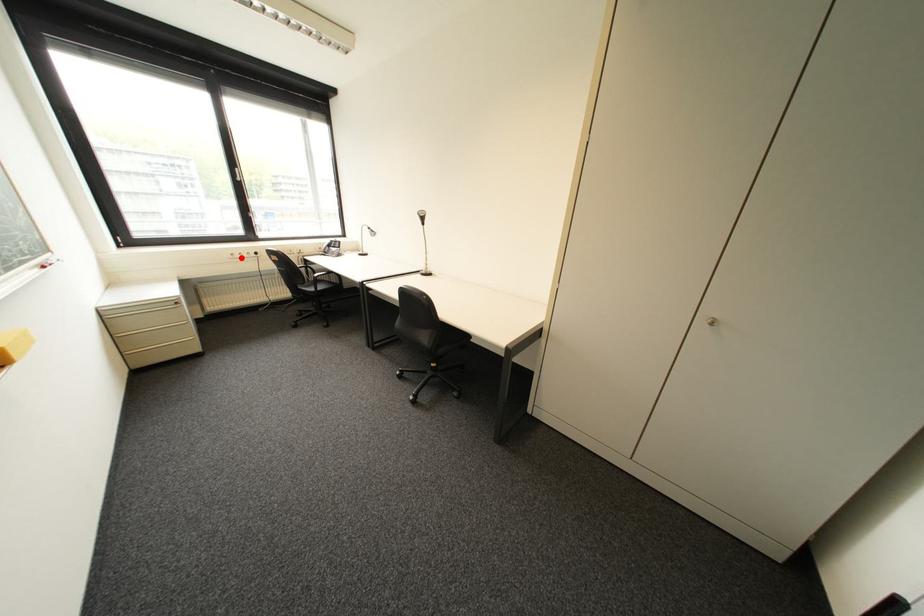
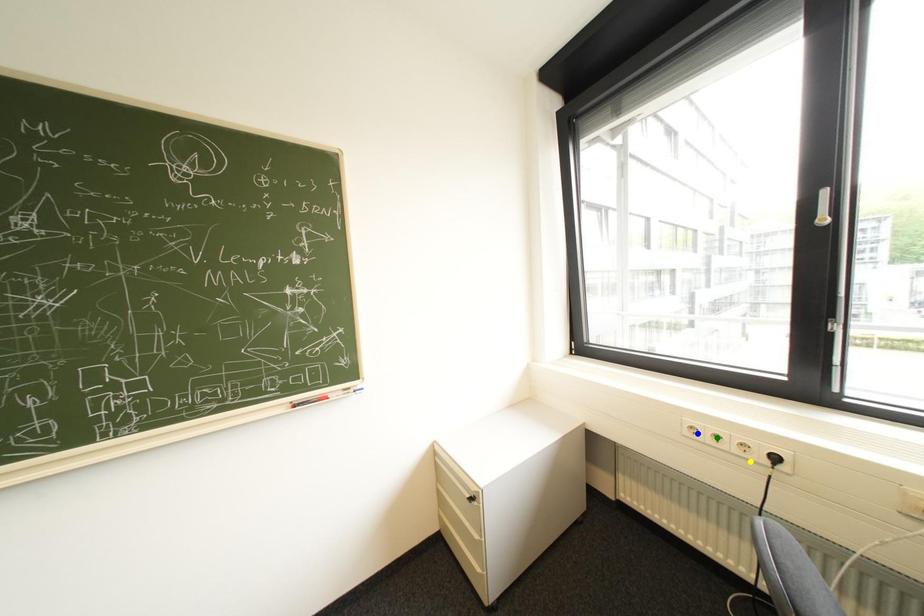
Question: I am providing you with two images of the same scene from different viewpoints. A red point is marked on the first image. You are given multiple points on the second image. Can you choose the point in image 2 that corresponds to the point in image 1?

Choices:
 (A) blue point
 (B) yellow point
 (C) green point

Answer: (A)